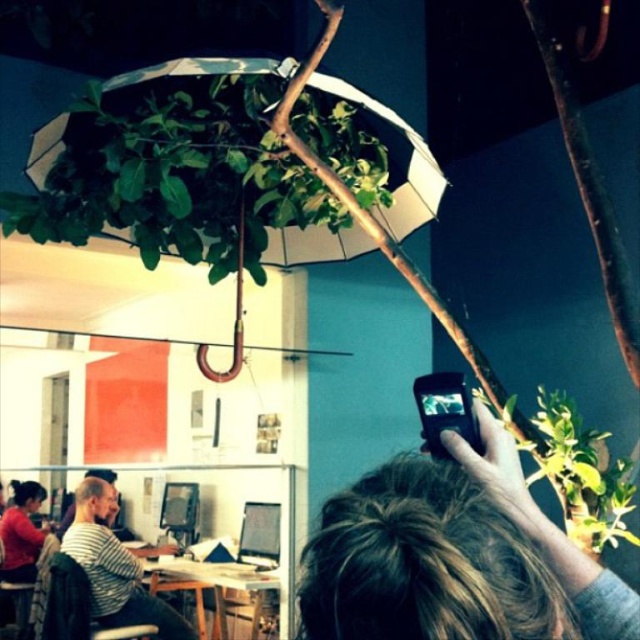
You are a photographer trying to capture a clear shot of the wooden table at center without any obstructions. What should you do to ensure the striped cotton shirt at center doesn not block your view?

The striped cotton shirt at center is in front of the wooden table at center, so to capture a clear shot of the wooden table at center without obstructions, you should move the striped cotton shirt at center out of the way or adjust your angle to position yourself behind it.

You are a delivery person who needs to place a small package on the wooden table at center. The package is 0.5 meters wide. Can you safely place it on the table without touching the white matte umbrella at upper center?

The white matte umbrella at upper center and wooden table at center are 1.56 meters apart. Since the package is only 0.5 meters wide, there is enough space between them to safely place the package on the wooden table at center without touching the umbrella.

You are standing at the origin point in the image. Which of the two points, point (163, 67) or point (74, 544), is closer to you?

Point (163, 67) is in front of point (74, 544), so it is closer to you.